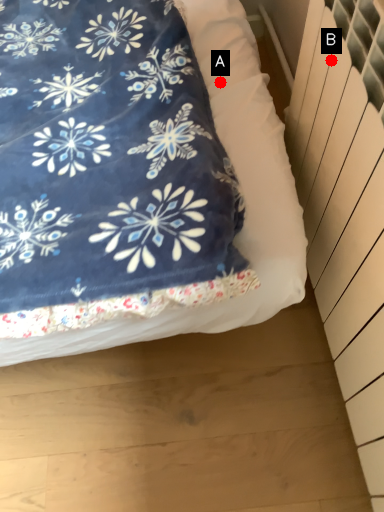
Question: Two points are circled on the image, labeled by A and B beside each circle. Which point is closer to the camera?

Choices:
 (A) A is closer
 (B) B is closer

Answer: (B)